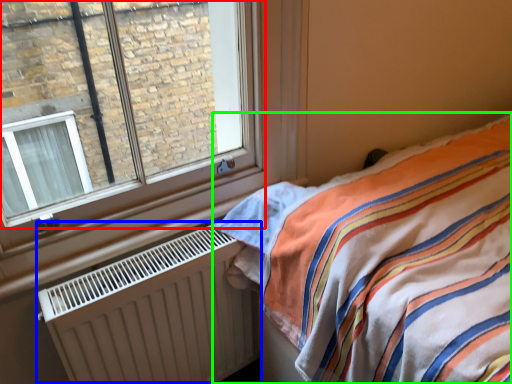
Question: Which object is the farthest from window (highlighted by a red box)? Choose among these: radiator (highlighted by a blue box) or bed (highlighted by a green box).

Choices:
 (A) radiator
 (B) bed

Answer: (B)